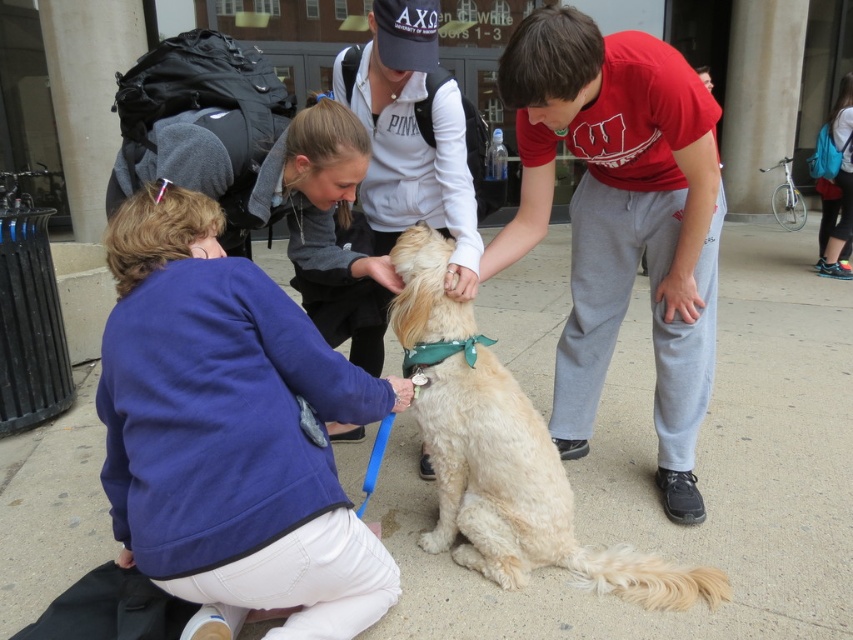
You are standing on the sidewalk and want to pet the golden fur dog at center. The dog is on the ground. To reach the dog, should you step onto the smooth concrete pavement at center or around it?

The smooth concrete pavement at center is located above the golden fur dog at center, so you should step onto the smooth concrete pavement at center to reach the dog.

Consider the image. You are standing in front of the group and want to move from the point marked at coordinate [819,381] to the point marked at [505,564]. Which direction should you move to get closer to the blue jacket and white pants person?

You should move towards the point marked at [505,564] because it is closer to the blue jacket and white pants person than the other point.

Based on the scene description, what is the 2D coordinate of the smooth concrete pavement at center?

The smooth concrete pavement at center is located at point (x=695, y=470).